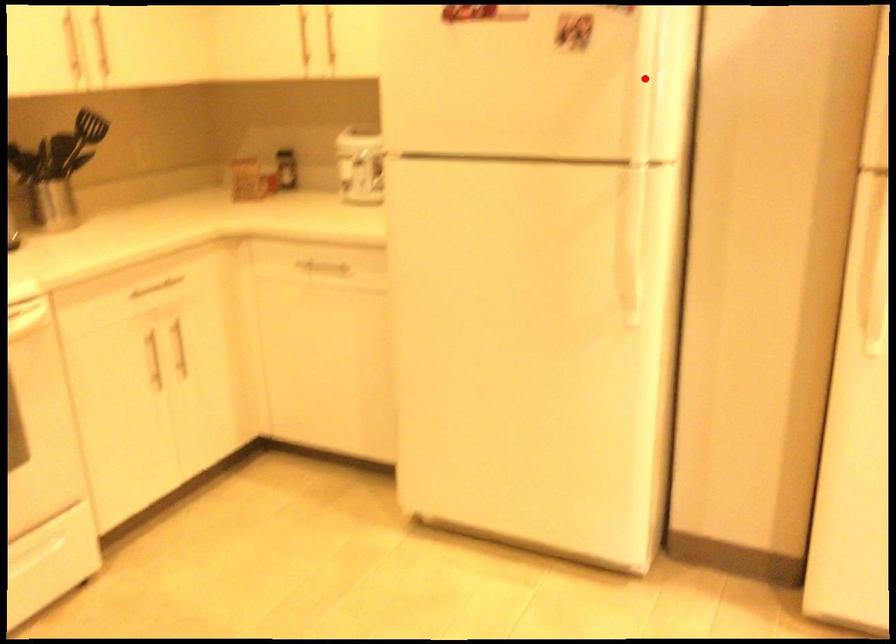
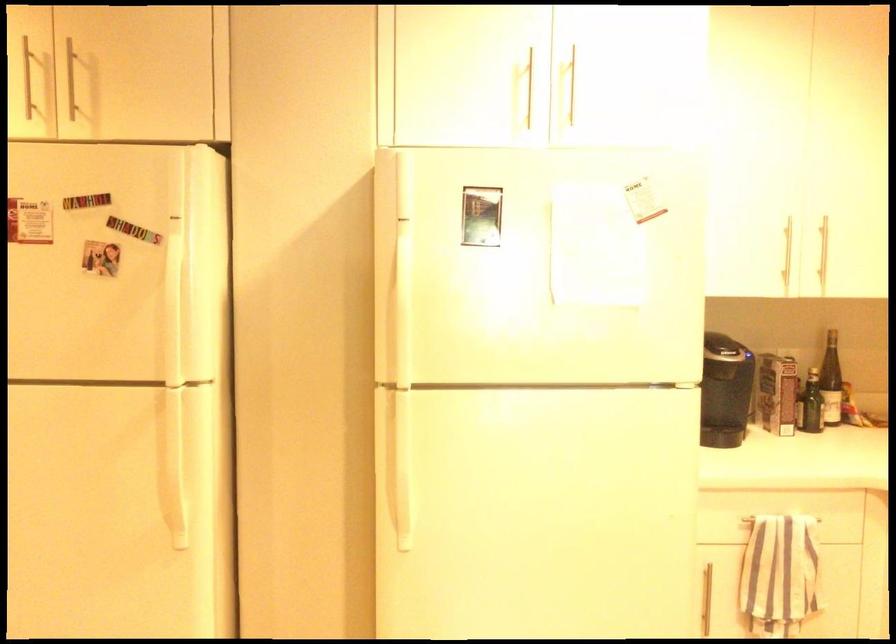
The point at the highlighted location is marked in the first image. Where is the corresponding point in the second image?

(177, 299)